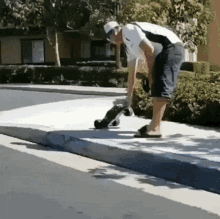
Image resolution: width=220 pixels, height=219 pixels. What are the coordinates of `toy` in the screenshot? It's located at (43, 77).